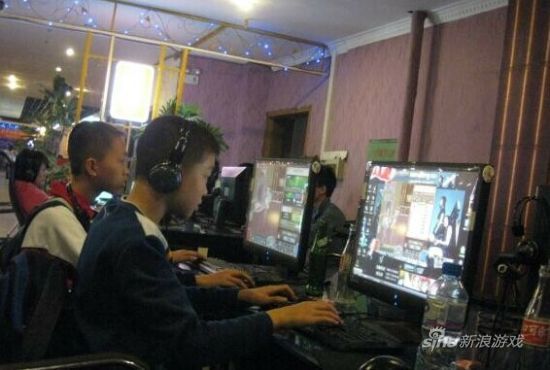
Identify the location of overhead lighting. (249, 6), (68, 51), (58, 68), (75, 87), (11, 78), (14, 86).